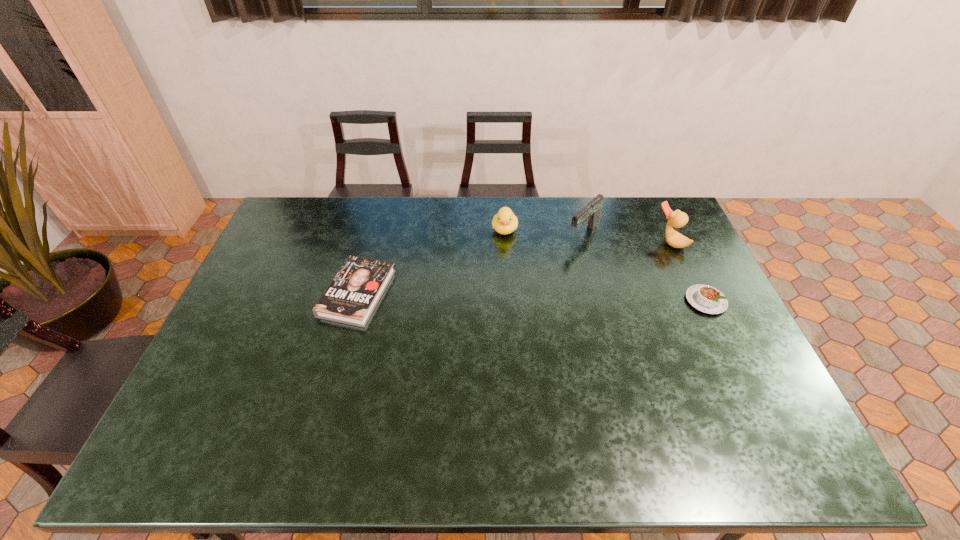
The width and height of the screenshot is (960, 540). What are the coordinates of `free area in between the second object from left to right and the shortest object` in the screenshot? It's located at (431, 261).

The image size is (960, 540). I want to click on empty space that is in between the duck and the third shortest object, so click(587, 235).

I want to click on free space between the shortest object and the fourth tallest object, so click(532, 297).

This screenshot has width=960, height=540. In order to click on free space between the pudding and the third tallest object in this screenshot , I will do `click(605, 265)`.

I want to click on vacant area that lies between the second object from left to right and the duck, so click(x=587, y=235).

Where is `blank region between the fourth tallest object and the shortest object`? This screenshot has width=960, height=540. blank region between the fourth tallest object and the shortest object is located at coordinates (532, 297).

Identify the location of free space between the third shortest object and the pudding. This screenshot has width=960, height=540. (605, 265).

I want to click on vacant area between the pudding and the second object from left to right, so click(605, 265).

Find the location of a particular element. free point between the shortest object and the third tallest object is located at coordinates (431, 261).

Locate an element on the screen. The height and width of the screenshot is (540, 960). object that is the third closest one to the third object from right to left is located at coordinates (707, 299).